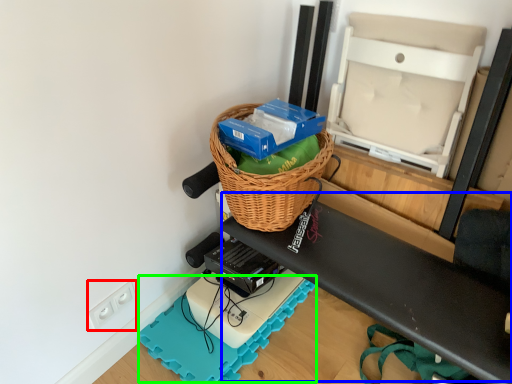
Question: Considering the real-world distances, which object is closest to electric outlet (highlighted by a red box)? wide (highlighted by a blue box) or yoga mat (highlighted by a green box).

Choices:
 (A) wide
 (B) yoga mat

Answer: (B)